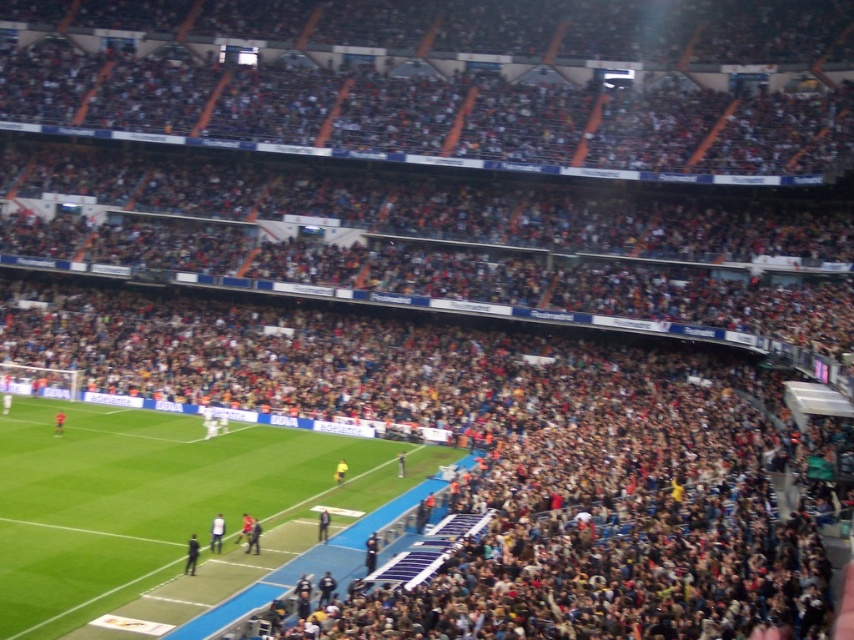
You are a drone operator trying to capture aerial shots of the soccer match. You have two points marked on your screen for camera positioning. The first point is at coordinates point (252, 524), and the second is at point (63, 420). If you want to film the action closest to the field, which point should you choose?

Point (252, 524) is in front of point (63, 420), so choosing point (252, 524) would place the camera closer to the field for better action shots.

From the picture: You are a photographer standing at the center of the soccer field. You want to take a photo of the black fabric person at lower left. Where should you point your camera to capture them in the frame?

You should point your camera towards the lower left direction, specifically at the coordinates point (191, 554) to capture the black fabric person at lower left in the frame.

You are a photographer positioned at the edge of the soccer field. You need to capture a photo that includes both the black fabric person at lower left and the yellow jersey at center. Which of the two should you focus on first to ensure both are in frame?

The black fabric person at lower left is taller than the yellow jersey at center, so you should focus on the black fabric person at lower left first to ensure both are in frame.